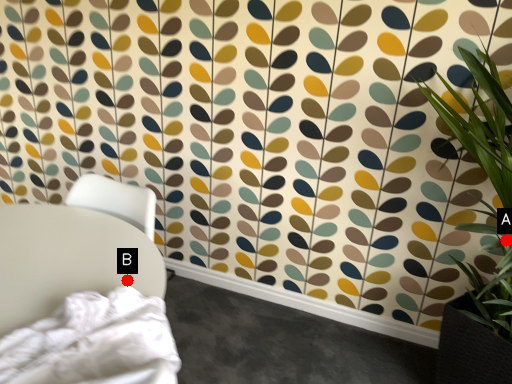
Question: Two points are circled on the image, labeled by A and B beside each circle. Which point is further to the camera?

Choices:
 (A) A is further
 (B) B is further

Answer: (A)